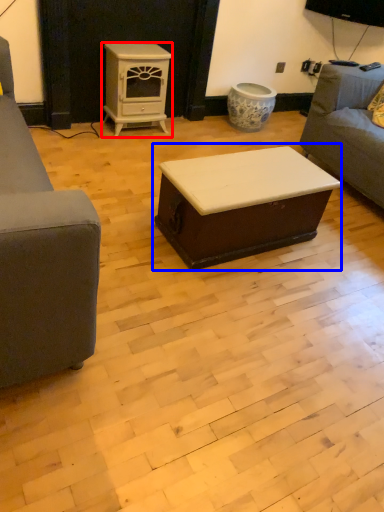
Question: Which point is closer to the camera, appliance (highlighted by a red box) or table (highlighted by a blue box)?

Choices:
 (A) appliance
 (B) table

Answer: (B)